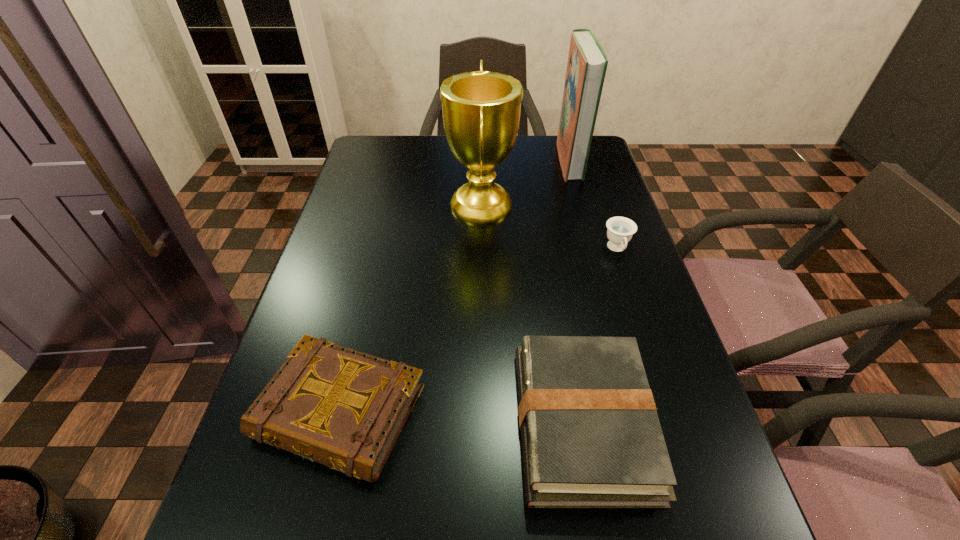
Where is `unoccupied area between the shortest hardback book and the award`? The width and height of the screenshot is (960, 540). unoccupied area between the shortest hardback book and the award is located at coordinates coord(411,309).

The image size is (960, 540). In order to click on free space between the farthest hardback book and the second shortest hardback book in this screenshot , I will do `click(576, 292)`.

Locate an element on the screen. The image size is (960, 540). vacant space that's between the award and the second tallest hardback book is located at coordinates (532, 314).

In order to click on free space that is in between the second shortest hardback book and the award in this screenshot , I will do `click(532, 314)`.

Locate an element on the screen. vacant area that lies between the award and the shortest hardback book is located at coordinates [411, 309].

Point out which object is positioned as the third nearest to the teacup. Please provide its 2D coordinates. Your answer should be formatted as a tuple, i.e. [(x, y)], where the tuple contains the x and y coordinates of a point satisfying the conditions above.

[(591, 438)]

Where is `object that stands as the second closest to the shortest hardback book`? The height and width of the screenshot is (540, 960). object that stands as the second closest to the shortest hardback book is located at coordinates (481, 109).

At what (x,y) coordinates should I click in order to perform the action: click on hardback book that is the second closest to the leftmost hardback book. Please return your answer as a coordinate pair (x, y). Image resolution: width=960 pixels, height=540 pixels. Looking at the image, I should click on (587, 63).

Locate an element on the screen. hardback book that stands as the second closest to the award is located at coordinates (345, 409).

Where is `free space that satisfies the following two spatial constraints: 1. on the side of the teacup with the handle; 2. on the spine side of the second shortest hardback book`? The width and height of the screenshot is (960, 540). free space that satisfies the following two spatial constraints: 1. on the side of the teacup with the handle; 2. on the spine side of the second shortest hardback book is located at coordinates (675, 423).